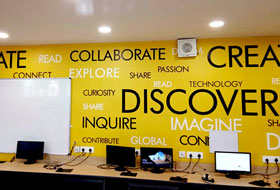
The width and height of the screenshot is (280, 190). I want to click on black monitor, so click(x=38, y=149).